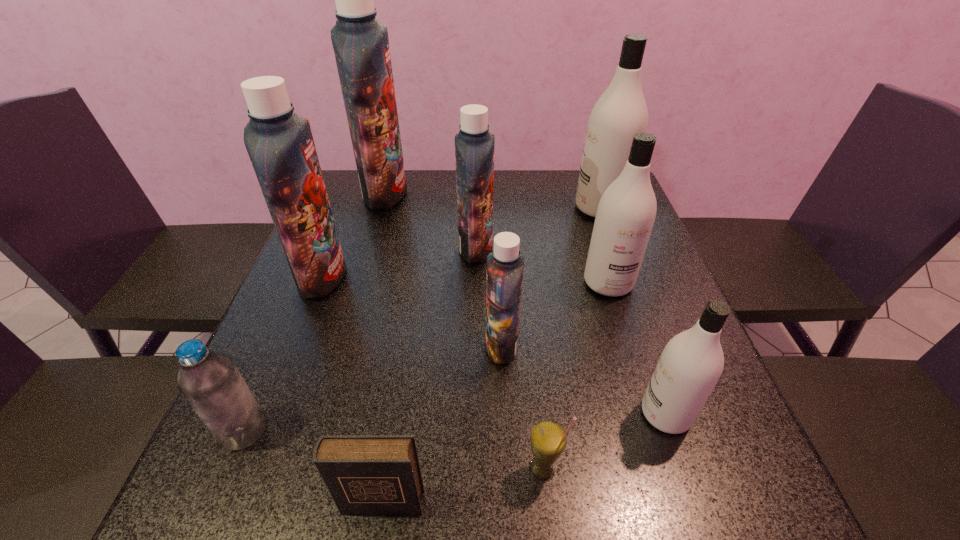
Where is `vacant point at the near right corner`? vacant point at the near right corner is located at coordinates (761, 492).

Where is `free point between the second nearest shampoo and the yellow straw for drinking`? Image resolution: width=960 pixels, height=540 pixels. free point between the second nearest shampoo and the yellow straw for drinking is located at coordinates (522, 407).

Where is `unoccupied area between the nearest blue shampoo and the tallest shampoo`? The width and height of the screenshot is (960, 540). unoccupied area between the nearest blue shampoo and the tallest shampoo is located at coordinates (444, 269).

The image size is (960, 540). What are the coordinates of `free space that is in between the eighth tallest object and the nearest white shampoo` in the screenshot? It's located at (455, 422).

Locate an element on the screen. This screenshot has width=960, height=540. free area in between the second smallest blue shampoo and the second farthest white shampoo is located at coordinates (542, 265).

At what (x,y) coordinates should I click in order to perform the action: click on the ninth closest object relative to the third shortest object. Please return your answer as a coordinate pair (x, y). This screenshot has height=540, width=960. Looking at the image, I should click on (621, 111).

I want to click on object that stands as the closest to the tallest object, so click(280, 144).

Point out which shampoo is positioned as the fourth nearest to the yellow straw for drinking. Please provide its 2D coordinates. Your answer should be formatted as a tuple, i.e. [(x, y)], where the tuple contains the x and y coordinates of a point satisfying the conditions above.

[(474, 145)]

The height and width of the screenshot is (540, 960). I want to click on shampoo that is the fourth nearest to the second nearest white shampoo, so point(691,363).

Find the location of a particular element. the closest blue shampoo to the second smallest blue shampoo is located at coordinates (361, 45).